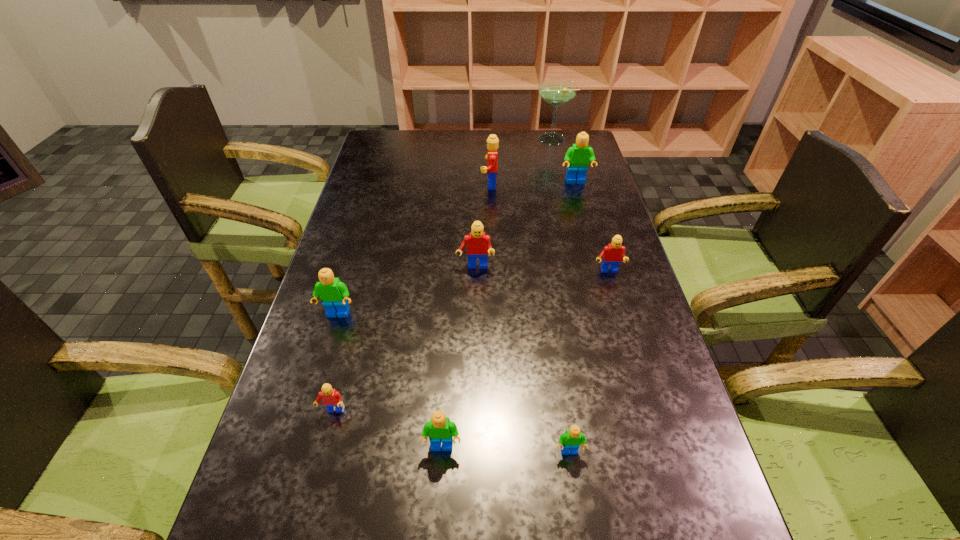
Identify the location of free region at the right edge of the desktop. The height and width of the screenshot is (540, 960). (684, 410).

This screenshot has height=540, width=960. In order to click on blank area at the far left corner in this screenshot , I will do (409, 131).

Identify the location of free space at the far right corner of the desktop. (572, 146).

Identify the location of free spot between the second biggest green Lego and the sixth farthest Lego. (336, 363).

The width and height of the screenshot is (960, 540). Identify the location of vacant point located between the leftmost red Lego and the second green Lego from left to right. (388, 429).

I want to click on vacant region between the rightmost red Lego and the second green Lego from left to right, so click(525, 360).

Locate an element on the screen. The image size is (960, 540). empty location between the second smallest green Lego and the third biggest red Lego is located at coordinates (525, 360).

Where is `vacant area that lies between the smallest red Lego and the second biggest red Lego`? This screenshot has width=960, height=540. vacant area that lies between the smallest red Lego and the second biggest red Lego is located at coordinates (404, 339).

Find the location of `vacant space that's between the second biggest red Lego and the green martini`. vacant space that's between the second biggest red Lego and the green martini is located at coordinates (513, 203).

At what (x,y) coordinates should I click in order to perform the action: click on vacant region between the biggest red Lego and the green martini. Please return your answer as a coordinate pair (x, y). The image size is (960, 540). Looking at the image, I should click on (520, 161).